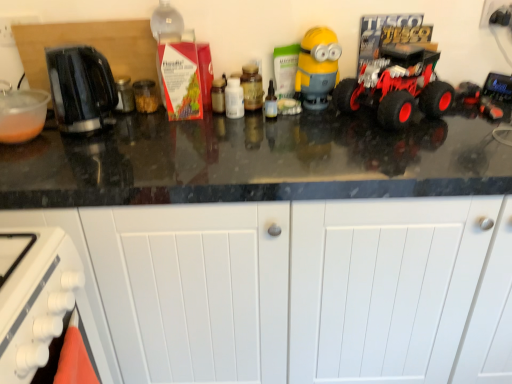
What are the coordinates of `vacant area in front of transparent glass bottle at center, acting as the 3th bottle starting from the left` in the screenshot? It's located at (285, 148).